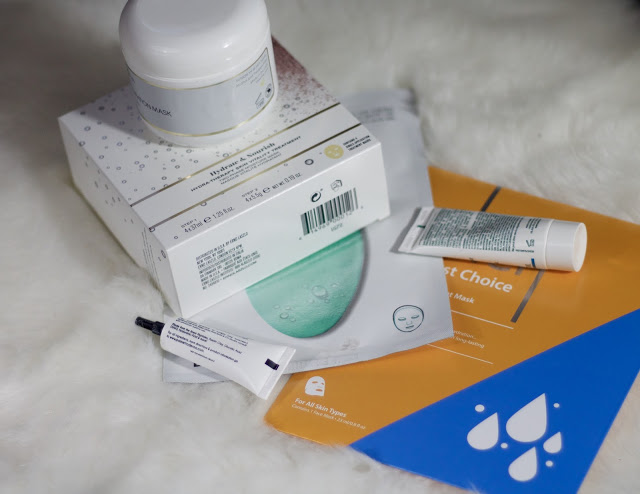
Locate an element on the screen. box is located at coordinates (124, 160).